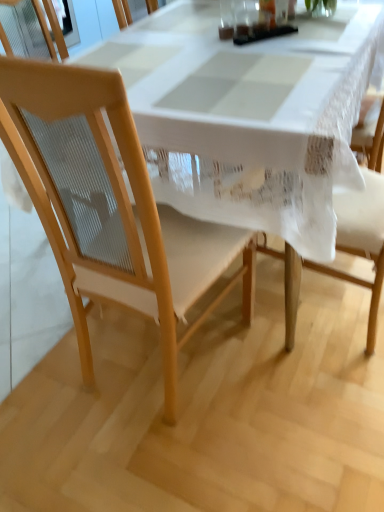
Identify the location of white lace tablecloth at center. The image size is (384, 512). (249, 117).

Describe the element at coordinates (249, 117) in the screenshot. I see `white lace tablecloth at center` at that location.

Locate an element on the screen. The image size is (384, 512). light wood chair at center is located at coordinates (110, 206).

This screenshot has height=512, width=384. Describe the element at coordinates (110, 206) in the screenshot. I see `light wood chair at center` at that location.

This screenshot has width=384, height=512. I want to click on white lace tablecloth at center, so click(x=249, y=117).

Between light wood chair at center and white lace tablecloth at center, which one appears on the left side from the viewer's perspective?

From the viewer's perspective, light wood chair at center appears more on the left side.

Which object is more forward, light wood chair at center or white lace tablecloth at center?

light wood chair at center is closer to the camera.

Between point (107, 144) and point (255, 187), which one is positioned behind?

The point (255, 187) is farther.

From the image's perspective, would you say light wood chair at center is shown under white lace tablecloth at center?

Correct, light wood chair at center appears lower than white lace tablecloth at center in the image.

From a real-world perspective, is light wood chair at center physically located above or below white lace tablecloth at center?

light wood chair at center is situated higher than white lace tablecloth at center in the real world.

Is light wood chair at center wider or thinner than white lace tablecloth at center?

Clearly, light wood chair at center has less width compared to white lace tablecloth at center.

Is light wood chair at center shorter than white lace tablecloth at center?

Incorrect, the height of light wood chair at center does not fall short of that of white lace tablecloth at center.

Which of these two, light wood chair at center or white lace tablecloth at center, is bigger?

white lace tablecloth at center is bigger.

Is light wood chair at center inside or outside of white lace tablecloth at center?

light wood chair at center lies within the bounds of white lace tablecloth at center.

Are light wood chair at center and white lace tablecloth at center located far from each other?

They are positioned close to each other.

Is light wood chair at center facing away from white lace tablecloth at center?

No, white lace tablecloth at center is not at the back of light wood chair at center.

Can you tell me how much light wood chair at center and white lace tablecloth at center differ in facing direction?

They differ by 176 degrees in their facing directions.

Find the location of a particular element. tablecloth behind the light wood chair at center is located at coordinates (249, 117).

Considering the positions of objects white lace tablecloth at center and light wood chair at center in the image provided, who is more to the left, white lace tablecloth at center or light wood chair at center?

light wood chair at center is more to the left.

Is white lace tablecloth at center further to the viewer compared to light wood chair at center?

Yes, white lace tablecloth at center is further from the camera.

Which is behind, point (334, 58) or point (16, 94)?

Positioned behind is point (334, 58).

From the image's perspective, relative to light wood chair at center, is white lace tablecloth at center above or below?

Clearly, from the image's perspective, white lace tablecloth at center is above light wood chair at center.

From a real-world perspective, relative to light wood chair at center, is white lace tablecloth at center vertically above or below?

Clearly, from a real-world perspective, white lace tablecloth at center is below light wood chair at center.

Can you confirm if white lace tablecloth at center is thinner than light wood chair at center?

Incorrect, the width of white lace tablecloth at center is not less than that of light wood chair at center.

Considering the sizes of objects white lace tablecloth at center and light wood chair at center in the image provided, who is taller, white lace tablecloth at center or light wood chair at center?

With more height is light wood chair at center.

Which of these two, white lace tablecloth at center or light wood chair at center, is smaller?

light wood chair at center is smaller.

Is white lace tablecloth at center located outside light wood chair at center?

Yes.

In the scene shown: Is white lace tablecloth at center far away from light wood chair at center?

That's not correct — white lace tablecloth at center is a little close to light wood chair at center.

Could you tell me if white lace tablecloth at center is turned towards light wood chair at center?

Yes.

How many degrees apart are the facing directions of white lace tablecloth at center and light wood chair at center?

The facing directions of white lace tablecloth at center and light wood chair at center are 176 degrees apart.

Identify the location of chair in front of the white lace tablecloth at center. (110, 206).

The height and width of the screenshot is (512, 384). Identify the location of tablecloth on the right side of light wood chair at center. (249, 117).

Where is `chair in front of the white lace tablecloth at center`? The image size is (384, 512). chair in front of the white lace tablecloth at center is located at coordinates (110, 206).